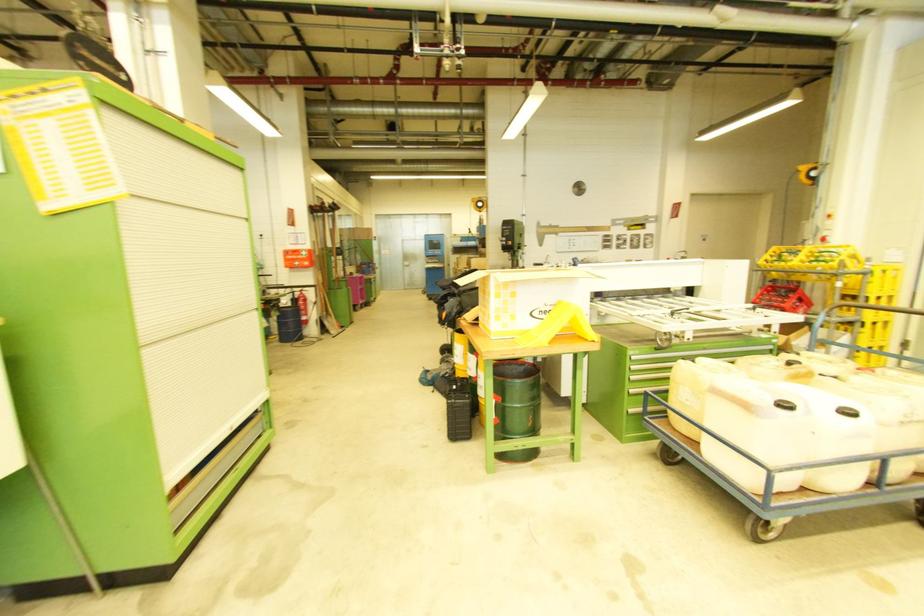
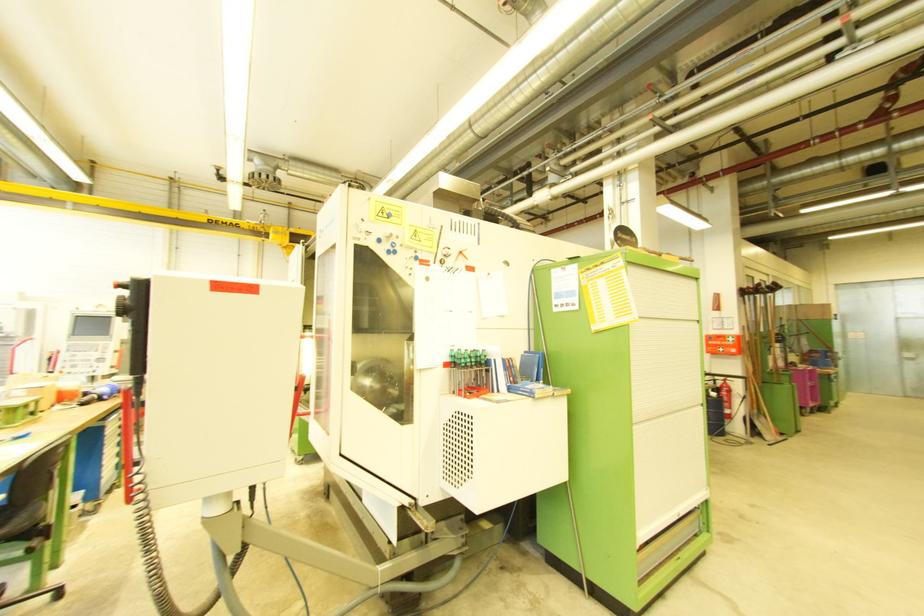
Find the pixel in the second image that matches point (314, 285) in the first image.

(740, 376)